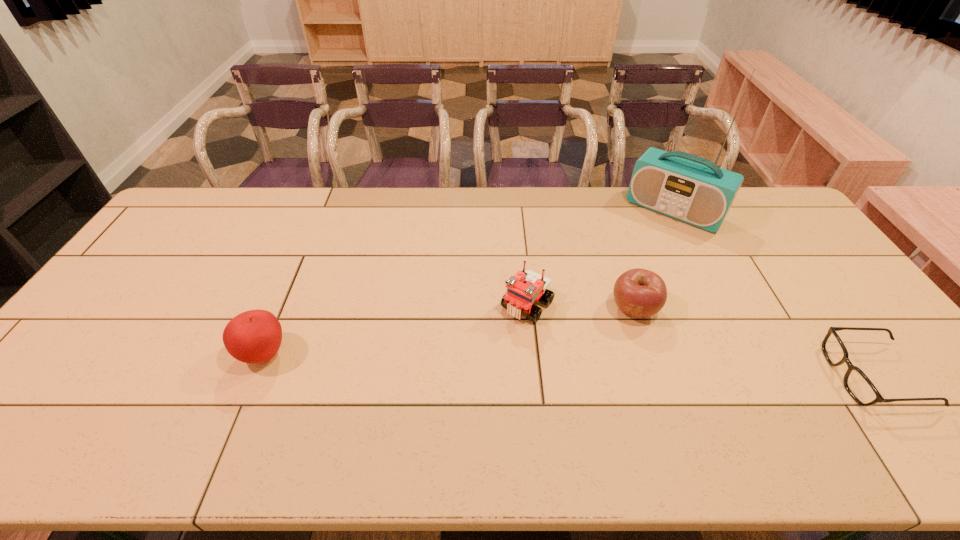
Image resolution: width=960 pixels, height=540 pixels. I want to click on the taller apple, so click(x=255, y=336).

You are a GUI agent. You are given a task and a screenshot of the screen. Output one action in this format:
    pyautogui.click(x=<x>, y=<y>)
    Task: Click on the nearer apple
    This screenshot has height=540, width=960.
    Given the screenshot: What is the action you would take?
    pyautogui.click(x=255, y=336)

Where is `spectacles`? The width and height of the screenshot is (960, 540). spectacles is located at coordinates (857, 384).

The image size is (960, 540). In order to click on the rightmost object in this screenshot , I will do `click(857, 384)`.

The height and width of the screenshot is (540, 960). In order to click on the tallest object in this screenshot , I will do `click(686, 187)`.

Locate an element on the screen. Image resolution: width=960 pixels, height=540 pixels. the farthest object is located at coordinates (686, 187).

Identify the location of the second shortest object. The width and height of the screenshot is (960, 540). click(639, 293).

Find the location of `the shorter apple`. the shorter apple is located at coordinates (639, 293).

This screenshot has width=960, height=540. Identify the location of the fourth object from right to left. (524, 288).

Identify the location of free spot located 0.080m on the right of the leftmost object. (322, 354).